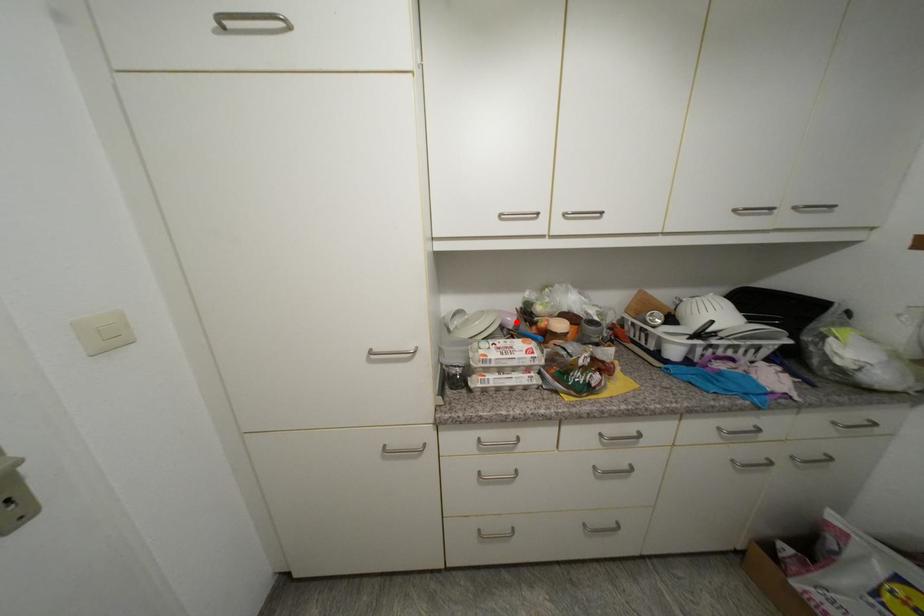
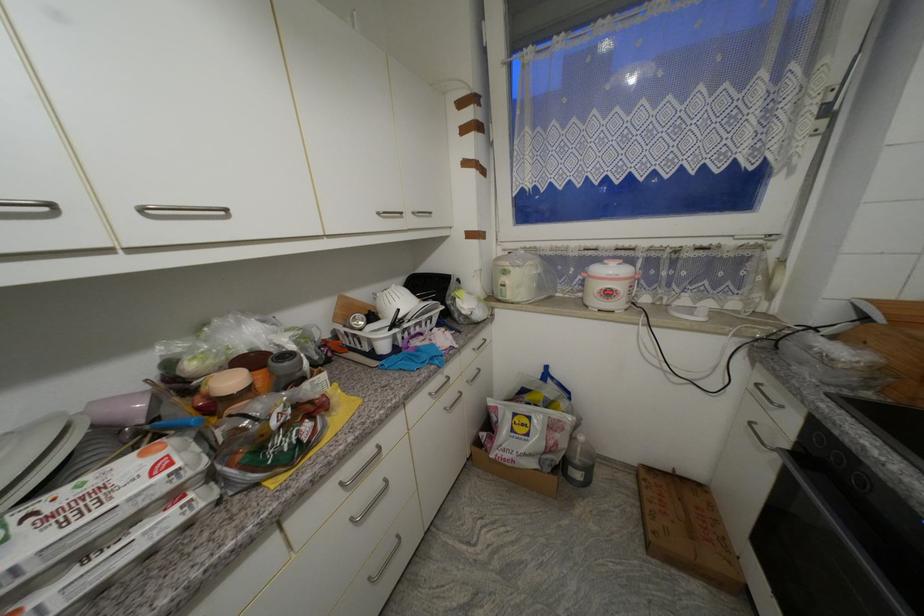
The point at the highlighted location is marked in the first image. Where is the corresponding point in the second image?

(146, 408)